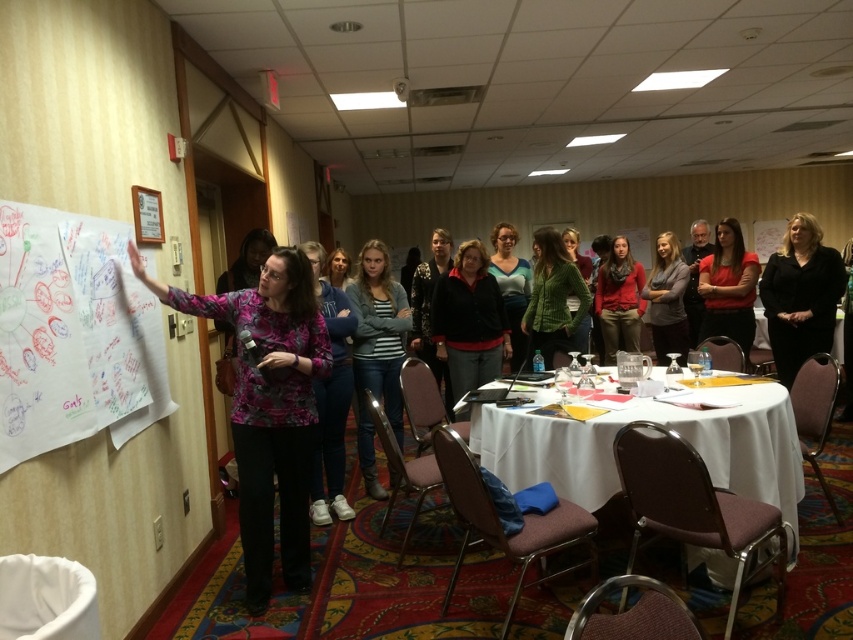
Question: Is striped knit sweater at center behind matte pink shirt at center?

Choices:
 (A) no
 (B) yes

Answer: (B)

Question: Where is white plastic table at center located in relation to dark red jacket at center in the image?

Choices:
 (A) above
 (B) below

Answer: (B)

Question: Is matte red blouse at center to the left of green knitted sweater at center from the viewer's perspective?

Choices:
 (A) no
 (B) yes

Answer: (A)

Question: Which object is positioned closest to the dark red jacket at center?

Choices:
 (A) matte red sweater at center
 (B) matte blue shirt at center
 (C) matte red blouse at center

Answer: (B)

Question: Estimate the real-world distances between objects in this image. Which object is closer to the matte pink blouse at center?

Choices:
 (A) dark red jacket at center
 (B) green fuzzy sweater at center
 (C) striped knit sweater at center

Answer: (C)

Question: Which point is closer to the camera taking this photo?

Choices:
 (A) (570, 284)
 (B) (563, 236)

Answer: (A)